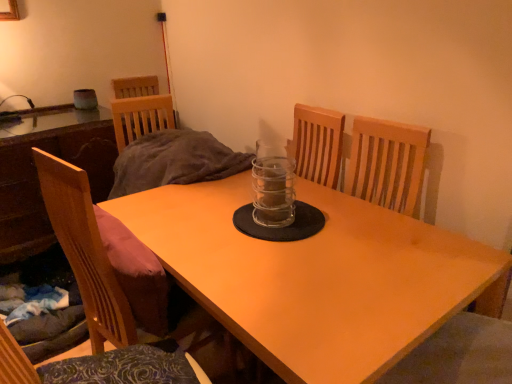
I want to click on vacant point to the left of transparent glass jar at center, so click(x=217, y=221).